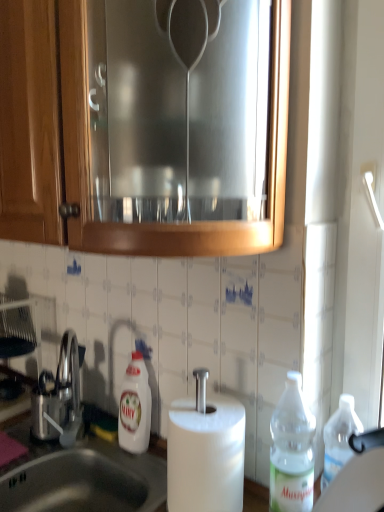
Question: Does white glossy bottle at lower center, the 2th bottle when ordered from front to back, appear on the right side of satin nickel faucet at lower left?

Choices:
 (A) no
 (B) yes

Answer: (B)

Question: Is white glossy bottle at lower center, the first bottle from the left, wider than satin nickel faucet at lower left?

Choices:
 (A) no
 (B) yes

Answer: (A)

Question: Is white glossy bottle at lower center, which is counted as the first bottle, starting from the back, completely or partially outside of satin nickel faucet at lower left?

Choices:
 (A) no
 (B) yes

Answer: (B)

Question: Is white glossy bottle at lower center, which is counted as the first bottle, starting from the back, facing away from satin nickel faucet at lower left?

Choices:
 (A) yes
 (B) no

Answer: (B)

Question: Does white glossy bottle at lower center, the 2th bottle when ordered from front to back, lie behind satin nickel faucet at lower left?

Choices:
 (A) yes
 (B) no

Answer: (B)

Question: From the image's perspective, is white glossy bottle at lower center, the first bottle from the left, below satin nickel faucet at lower left?

Choices:
 (A) yes
 (B) no

Answer: (A)

Question: Can you confirm if satin silver sink at lower left is smaller than brushed metal cabinet at upper center?

Choices:
 (A) no
 (B) yes

Answer: (B)

Question: Is satin silver sink at lower left next to brushed metal cabinet at upper center and touching it?

Choices:
 (A) no
 (B) yes

Answer: (A)

Question: Would you consider satin silver sink at lower left to be distant from brushed metal cabinet at upper center?

Choices:
 (A) yes
 (B) no

Answer: (B)

Question: Considering the relative sizes of satin silver sink at lower left and brushed metal cabinet at upper center in the image provided, is satin silver sink at lower left wider than brushed metal cabinet at upper center?

Choices:
 (A) no
 (B) yes

Answer: (A)

Question: Considering the relative positions of satin silver sink at lower left and brushed metal cabinet at upper center in the image provided, is satin silver sink at lower left behind brushed metal cabinet at upper center?

Choices:
 (A) no
 (B) yes

Answer: (B)

Question: From a real-world perspective, is satin silver sink at lower left located higher than brushed metal cabinet at upper center?

Choices:
 (A) no
 (B) yes

Answer: (A)

Question: Does white glossy bottle at lower center, which is counted as the first bottle, starting from the back, lie in front of satin silver sink at lower left?

Choices:
 (A) no
 (B) yes

Answer: (A)